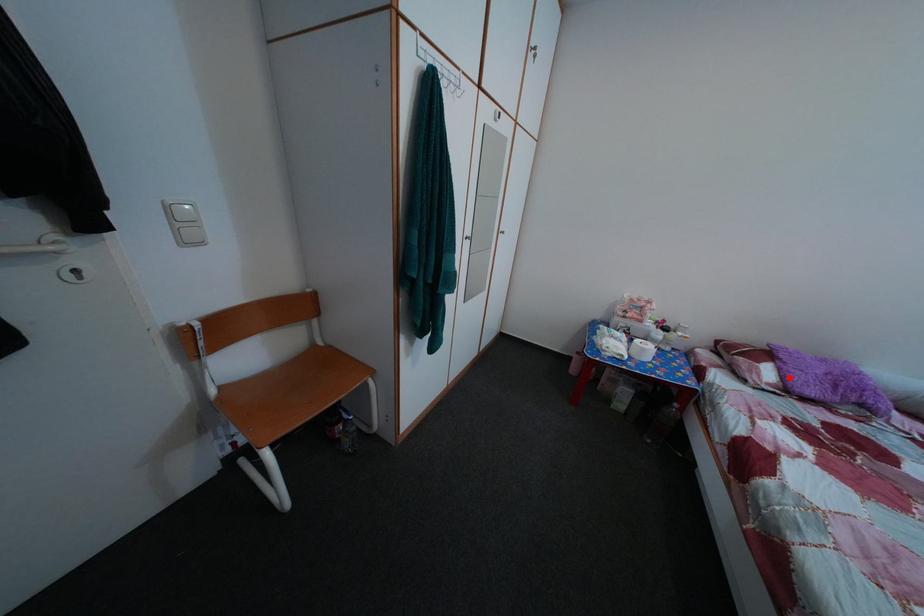
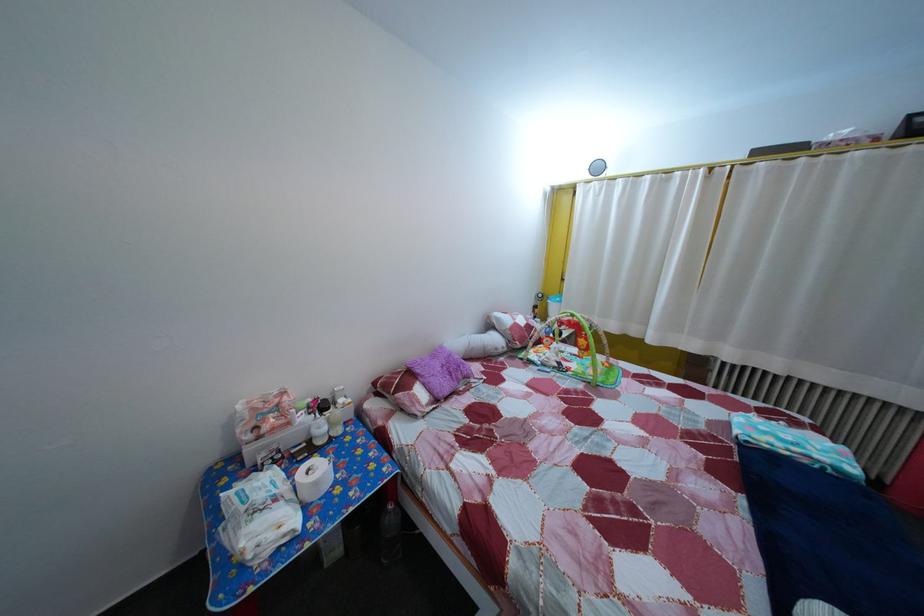
Question: I am providing you with two images of the same scene from different viewpoints. Given a red point in image1, look at the same physical point in image2. Is it:

Choices:
 (A) Closer to the viewpoint
 (B) Farther from the viewpoint

Answer: (B)